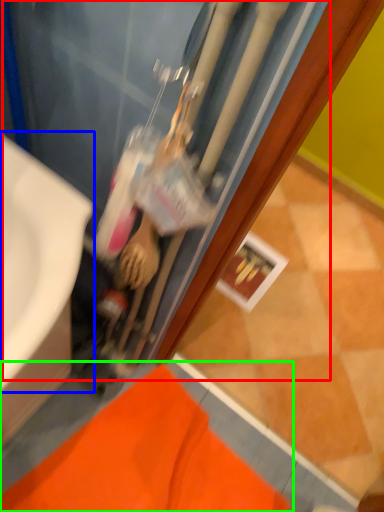
Question: Based on their relative distances, which object is nearer to water heater (highlighted by a red box)? Choose from sink (highlighted by a blue box) and bath mat (highlighted by a green box).

Choices:
 (A) sink
 (B) bath mat

Answer: (A)